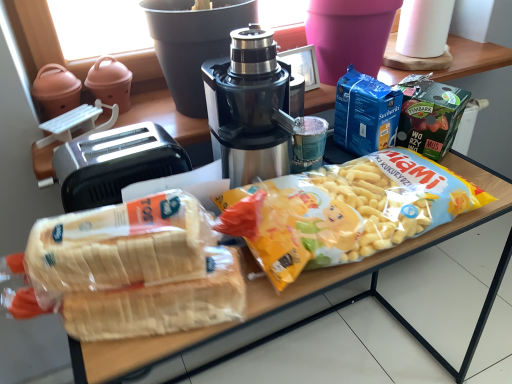
The width and height of the screenshot is (512, 384). In order to click on blank space situated above black plastic toaster at left (from a real-world perspective) in this screenshot , I will do `click(119, 147)`.